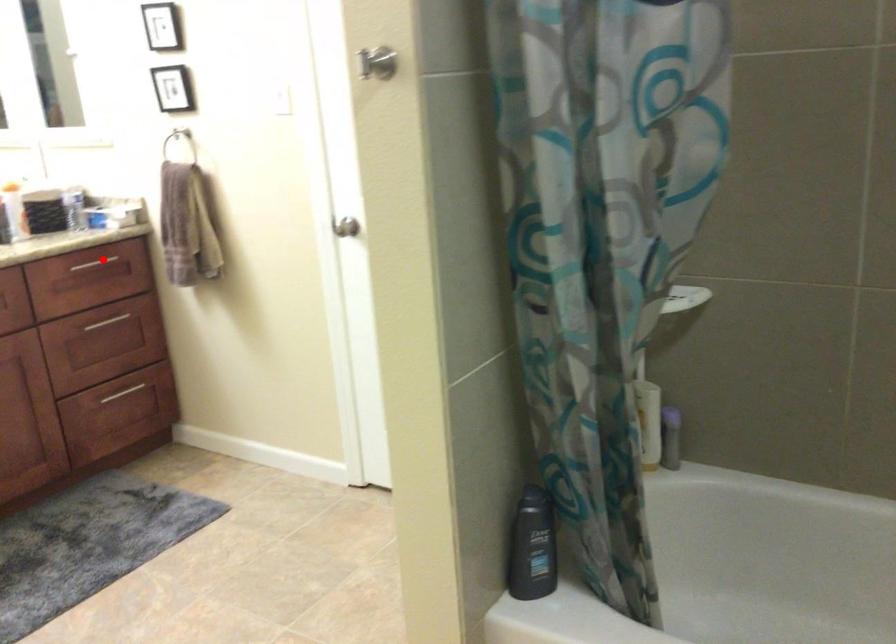
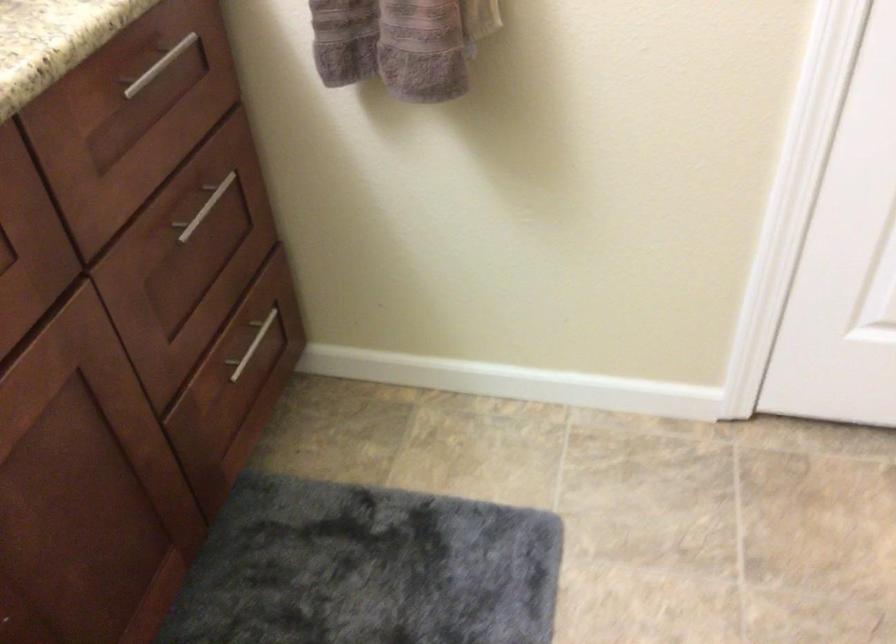
Locate, in the second image, the point that corresponds to the highlighted location in the first image.

(159, 66)